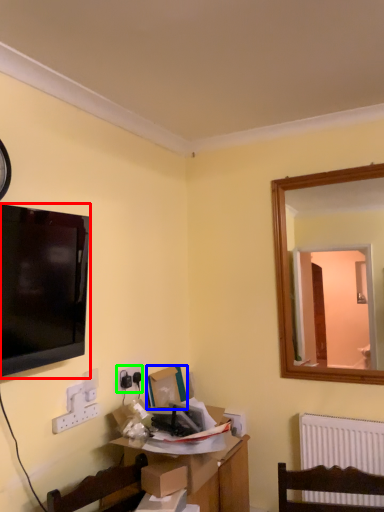
Question: Considering the real-world distances, which object is farthest from television (highlighted by a red box)? box (highlighted by a blue box) or electric outlet (highlighted by a green box)?

Choices:
 (A) box
 (B) electric outlet

Answer: (A)